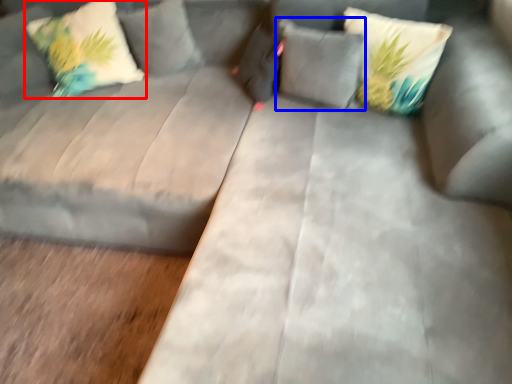
Question: Which object appears farthest to the camera in this image, pillow (highlighted by a red box) or pillow (highlighted by a blue box)?

Choices:
 (A) pillow
 (B) pillow

Answer: (A)